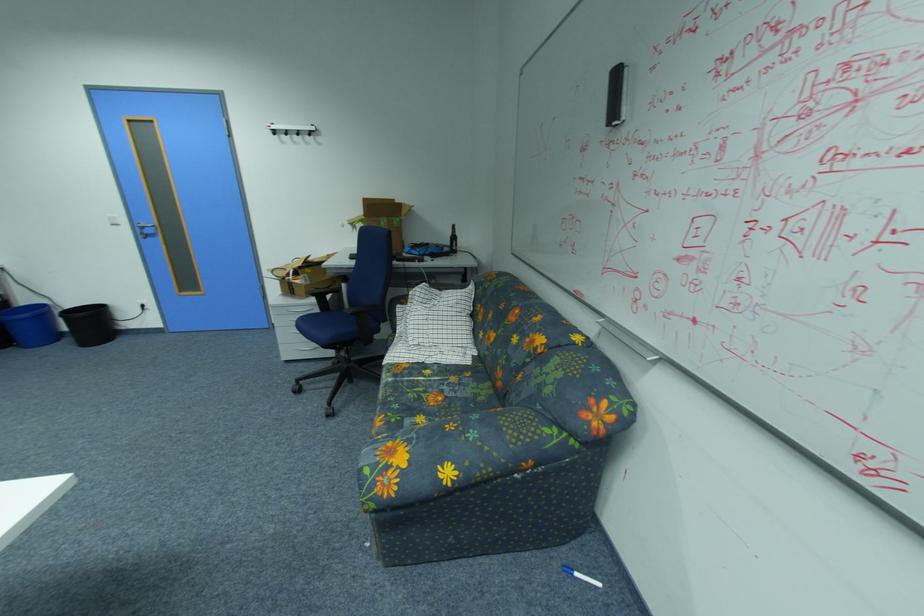
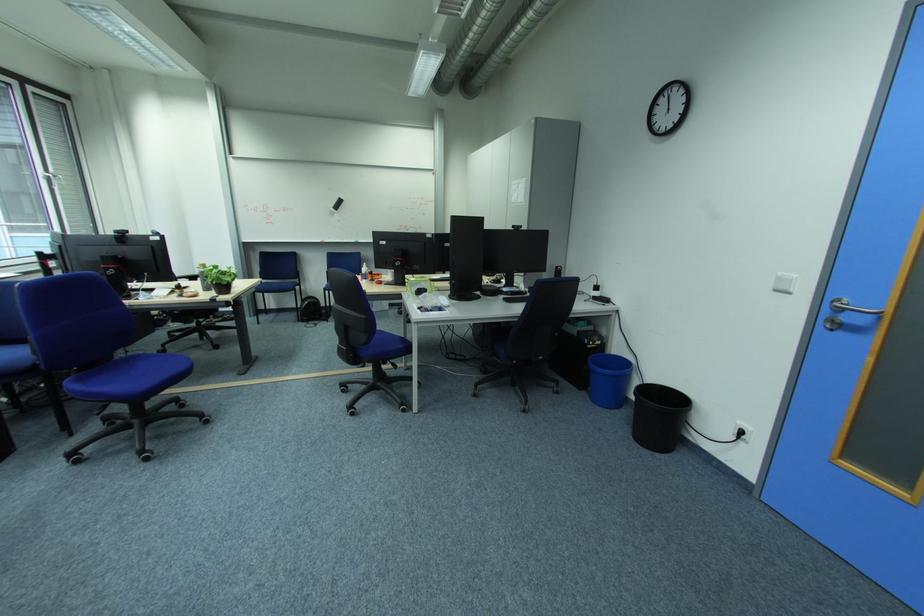
The point at (123, 227) is marked in the first image. Where is the corresponding point in the second image?

(785, 292)